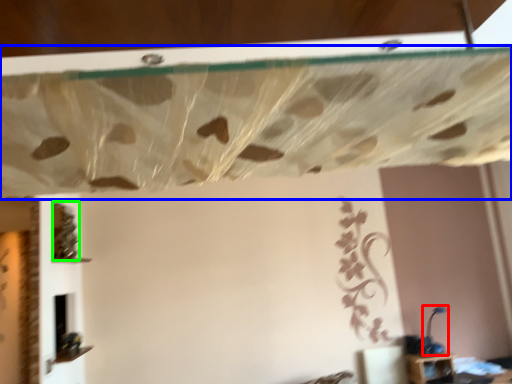
Question: Based on their relative distances, which object is nearer to lamp (highlighted by a red box)? Choose from curtain (highlighted by a blue box) and vine (highlighted by a green box).

Choices:
 (A) curtain
 (B) vine

Answer: (B)